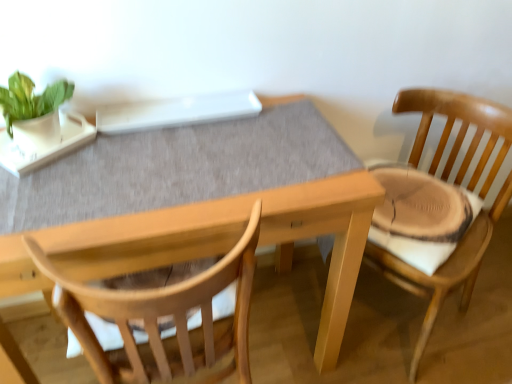
Describe the element at coordinates (459, 130) in the screenshot. The height and width of the screenshot is (384, 512). I see `wooden chair at right` at that location.

Image resolution: width=512 pixels, height=384 pixels. What do you see at coordinates (33, 111) in the screenshot?
I see `green matte plant at upper left` at bounding box center [33, 111].

Identify the location of wooden table at center. Image resolution: width=512 pixels, height=384 pixels. (234, 239).

Is wooden table at center next to green matte plant at upper left?

No, wooden table at center is not in contact with green matte plant at upper left.

From the picture: Considering the relative sizes of wooden table at center and green matte plant at upper left in the image provided, is wooden table at center taller than green matte plant at upper left?

Yes.

From the image's perspective, is wooden table at center above or below green matte plant at upper left?

Based on their image positions, wooden table at center is located beneath green matte plant at upper left.

Which object is thinner, wooden chair at right or green matte plant at upper left?

green matte plant at upper left is thinner.

Are wooden chair at right and green matte plant at upper left making contact?

wooden chair at right and green matte plant at upper left are clearly separated.

Looking at the image, does wooden chair at right seem bigger or smaller compared to green matte plant at upper left?

In the image, wooden chair at right appears to be larger than green matte plant at upper left.

Is wooden chair at right in front of or behind wooden table at center in the image?

Clearly, wooden chair at right is behind wooden table at center.

Considering the relative sizes of wooden chair at right and wooden table at center in the image provided, is wooden chair at right smaller than wooden table at center?

Yes, wooden chair at right is smaller than wooden table at center.

Considering the positions of objects wooden chair at right and wooden table at center in the image provided, who is more to the right, wooden chair at right or wooden table at center?

wooden chair at right is more to the right.

From the image's perspective, which one is positioned higher, wooden chair at right or wooden table at center?

wooden chair at right, from the image's perspective.

From the image's perspective, does green matte plant at upper left appear higher than wooden table at center?

Yes.

From a real-world perspective, does green matte plant at upper left stand above wooden table at center?

Yes, from a real-world perspective, green matte plant at upper left is over wooden table at center

Is green matte plant at upper left touching wooden table at center?

No, green matte plant at upper left is not beside wooden table at center.

Could you tell me if green matte plant at upper left is turned towards wooden table at center?

No.

Are wooden table at center and wooden chair at right far apart?

wooden table at center is near wooden chair at right, not far away.

Is wooden table at center inside or outside of wooden chair at right?

wooden table at center lies outside wooden chair at right.

Considering the relative sizes of wooden table at center and wooden chair at right in the image provided, is wooden table at center shorter than wooden chair at right?

Indeed, wooden table at center has a lesser height compared to wooden chair at right.

Is wooden chair at right at the back of wooden table at center?

No, wooden table at center's orientation is not away from wooden chair at right.

Does green matte plant at upper left have a larger size compared to wooden chair at right?

Incorrect, green matte plant at upper left is not larger than wooden chair at right.

Which object is thinner, green matte plant at upper left or wooden chair at right?

With smaller width is green matte plant at upper left.

What's the angular difference between green matte plant at upper left and wooden chair at right's facing directions?

95.5 degrees.

Locate an element on the screen. The height and width of the screenshot is (384, 512). table on the right of green matte plant at upper left is located at coordinates (234, 239).

Where is `chair in front of the green matte plant at upper left`? This screenshot has width=512, height=384. chair in front of the green matte plant at upper left is located at coordinates (459, 130).

Considering their positions, is wooden chair at right positioned further to wooden table at center than green matte plant at upper left?

Among the two, green matte plant at upper left is located further to wooden table at center.

Considering their positions, is wooden chair at right positioned closer to green matte plant at upper left than wooden table at center?

wooden table at center lies closer to green matte plant at upper left than the other object.

Based on their spatial positions, is green matte plant at upper left or wooden chair at right further from wooden table at center?

green matte plant at upper left lies further to wooden table at center than the other object.

Considering their positions, is wooden table at center positioned closer to wooden chair at right than green matte plant at upper left?

wooden table at center is closer to wooden chair at right.

Based on their spatial positions, is green matte plant at upper left or wooden table at center closer to wooden chair at right?

The object closer to wooden chair at right is wooden table at center.

Considering their positions, is wooden table at center positioned closer to green matte plant at upper left than wooden chair at right?

wooden table at center lies closer to green matte plant at upper left than the other object.

The width and height of the screenshot is (512, 384). In order to click on table located between green matte plant at upper left and wooden chair at right in the left-right direction in this screenshot , I will do `click(234, 239)`.